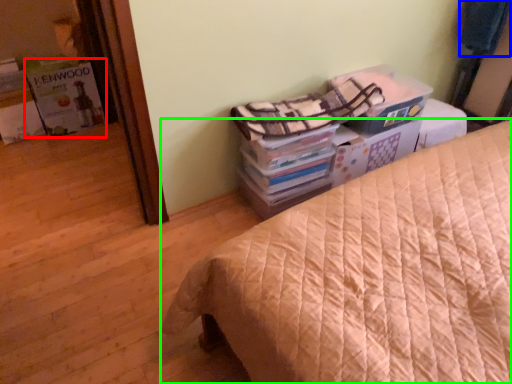
Question: Which object is the closest to the magazine (highlighted by a red box)? Choose among these: blanket (highlighted by a blue box) or bed (highlighted by a green box).

Choices:
 (A) blanket
 (B) bed

Answer: (B)